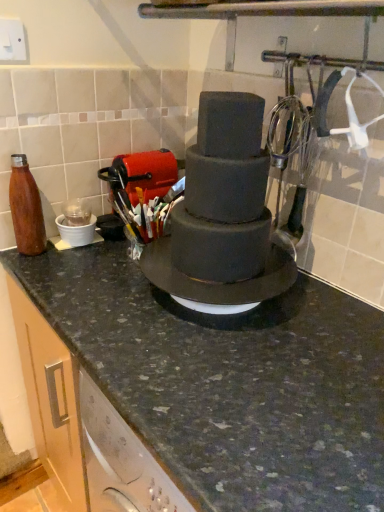
Locate an element on the screen. The image size is (384, 512). free space above granite countertop at center (from a real-world perspective) is located at coordinates (271, 373).